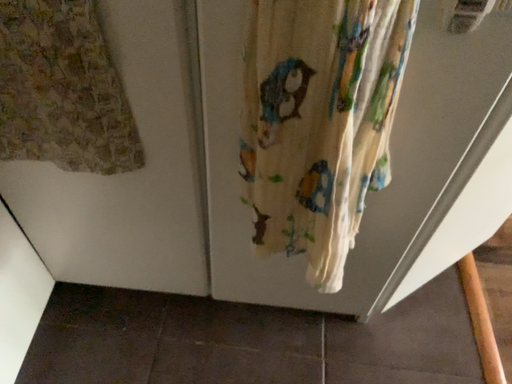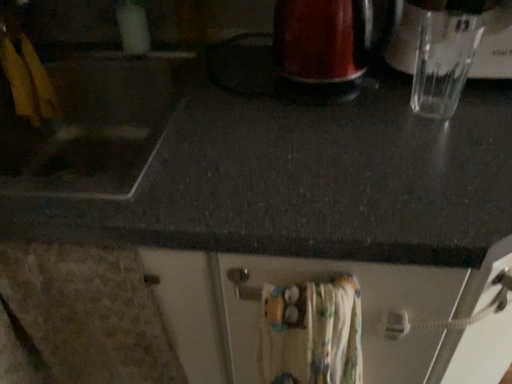
Question: How did the camera likely rotate when shooting the video?

Choices:
 (A) rotated upward
 (B) rotated downward

Answer: (A)